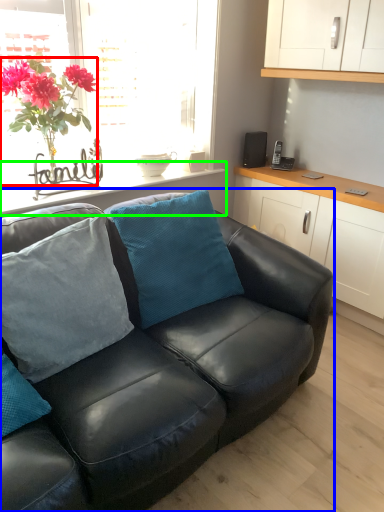
Question: Which object is positioned closest to houseplant (highlighted by a red box)? Select from studio couch (highlighted by a blue box) and window sill (highlighted by a green box).

Choices:
 (A) studio couch
 (B) window sill

Answer: (B)